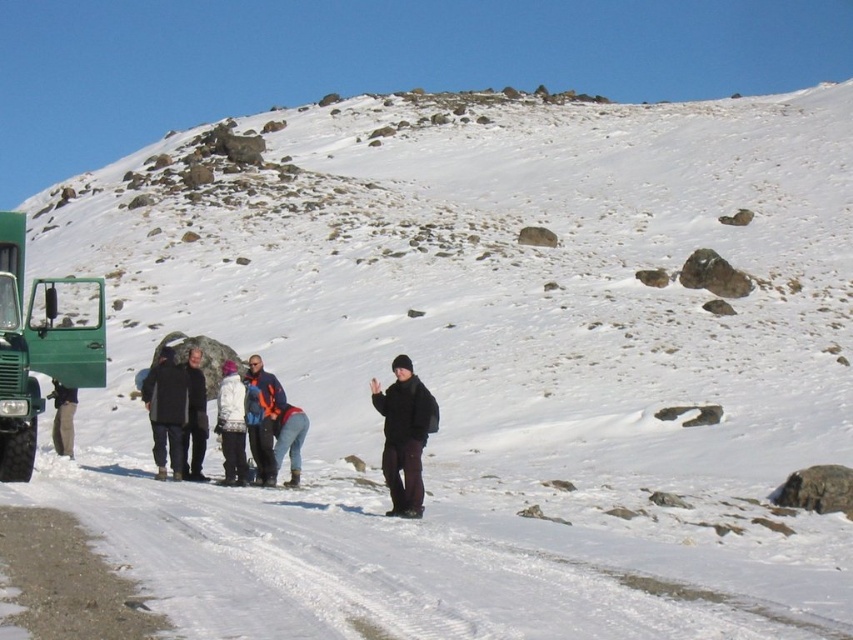
Is black woolen jacket at center closer to the viewer compared to dark gray pants at center?

No, it is behind dark gray pants at center.

In the scene shown: Does black woolen jacket at center have a larger size compared to dark gray pants at center?

Incorrect, black woolen jacket at center is not larger than dark gray pants at center.

What do you see at coordinates (194, 419) in the screenshot? The width and height of the screenshot is (853, 640). I see `black woolen jacket at center` at bounding box center [194, 419].

The width and height of the screenshot is (853, 640). What are the coordinates of `black woolen jacket at center` in the screenshot? It's located at (194, 419).

How distant is white fuzzy jacket at center from dark gray pants at center?

A distance of 3.83 meters exists between white fuzzy jacket at center and dark gray pants at center.

Does white fuzzy jacket at center appear over dark gray pants at center?

Yes, white fuzzy jacket at center is above dark gray pants at center.

The width and height of the screenshot is (853, 640). I want to click on white fuzzy jacket at center, so click(x=231, y=424).

From the picture: How far apart are dark gray fabric jacket at center and dark gray pants at center?

dark gray fabric jacket at center is 14.29 feet from dark gray pants at center.

Who is more distant from viewer, (149, 401) or (71, 436)?

Positioned behind is point (71, 436).

At what (x,y) coordinates should I click in order to perform the action: click on dark gray fabric jacket at center. Please return your answer as a coordinate pair (x, y). Looking at the image, I should click on (166, 410).